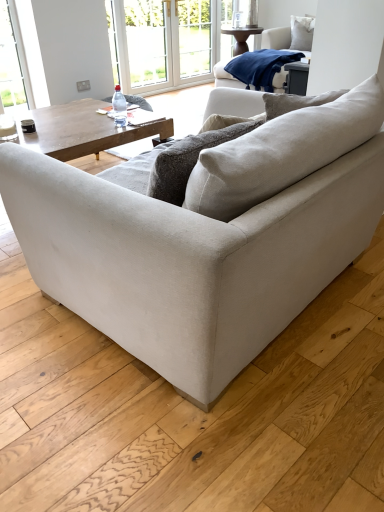
Question: Considering the positions of transparent plastic bottle at center and white soft cushion at upper right in the image, is transparent plastic bottle at center bigger or smaller than white soft cushion at upper right?

Choices:
 (A) small
 (B) big

Answer: (A)

Question: From a real-world perspective, relative to white soft cushion at upper right, is transparent plastic bottle at center vertically above or below?

Choices:
 (A) below
 (B) above

Answer: (A)

Question: Which object is the farthest from the white glass screen door at upper center?

Choices:
 (A) beige fabric couch at center
 (B) transparent plastic bottle at center
 (C) white soft cushion at upper right
 (D) navy blue fleece blanket at upper right
 (E) transparent plastic window screen at upper center

Answer: (A)

Question: Which is nearer to the navy blue fleece blanket at upper right?

Choices:
 (A) white plastic window frame at upper center
 (B) white glass screen door at upper center
 (C) transparent plastic bottle at center
 (D) white glossy coffee cup at upper left
 (E) beige fabric couch at center

Answer: (A)